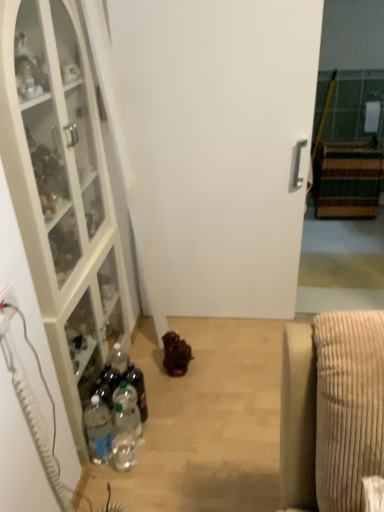
Identify the location of free spot to the right of clear plastic bottle at lower left, which is the 1th bottle in left-to-right order. (161, 453).